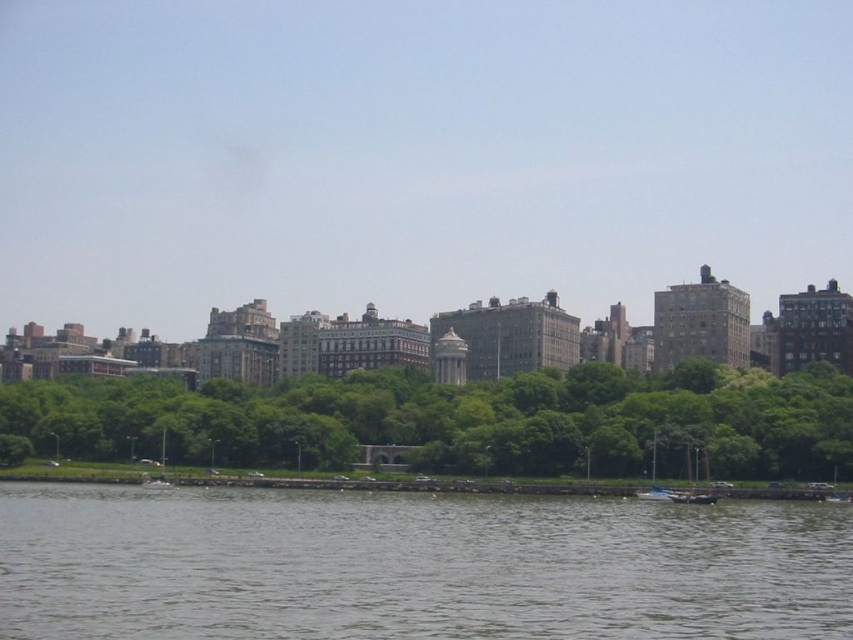
Question: Does green leafy trees at center have a lesser width compared to wooden boat at lower right?

Choices:
 (A) no
 (B) yes

Answer: (A)

Question: From the image, what is the correct spatial relationship of green leafy trees at center in relation to wooden boat at lower right?

Choices:
 (A) right
 (B) left

Answer: (B)

Question: Which object is closer to the camera taking this photo?

Choices:
 (A) white glossy boat at lower right
 (B) green leafy trees at center
 (C) gray water at lower center

Answer: (C)

Question: Which point is closer to the camera?

Choices:
 (A) (647, 496)
 (B) (154, 488)
 (C) (688, 492)
 (D) (395, 417)

Answer: (C)

Question: Among these points, which one is nearest to the camera?

Choices:
 (A) (165, 481)
 (B) (671, 499)

Answer: (B)

Question: Does gray water at lower center appear on the right side of green leafy trees at center?

Choices:
 (A) no
 (B) yes

Answer: (B)